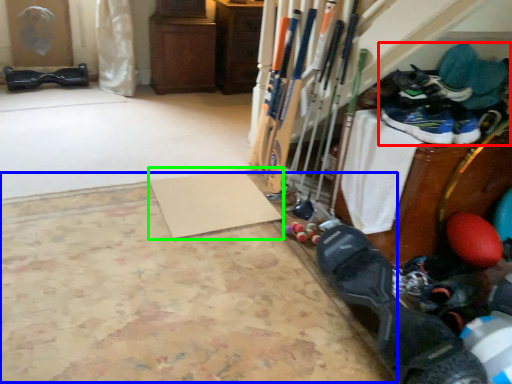
Question: Estimate the real-world distances between objects in this image. Which object is farther from footwear (highlighted by a red box), yoga mat (highlighted by a blue box) or yoga mat (highlighted by a green box)?

Choices:
 (A) yoga mat
 (B) yoga mat

Answer: (A)